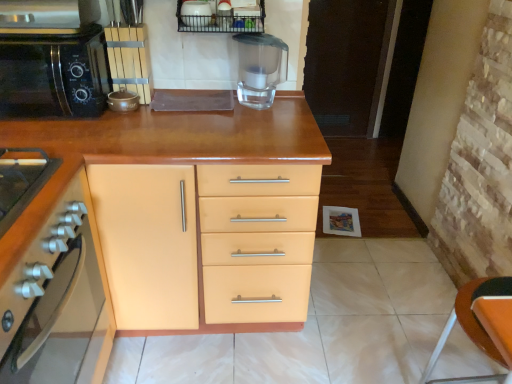
You are a GUI agent. You are given a task and a screenshot of the screen. Output one action in this format:
    pyautogui.click(x=<x>, y=<y>)
    Task: Click on the free location to the right of matte brown pot at upper left, the first appliance from the bottom
    This screenshot has width=512, height=384.
    Given the screenshot: What is the action you would take?
    pyautogui.click(x=165, y=115)